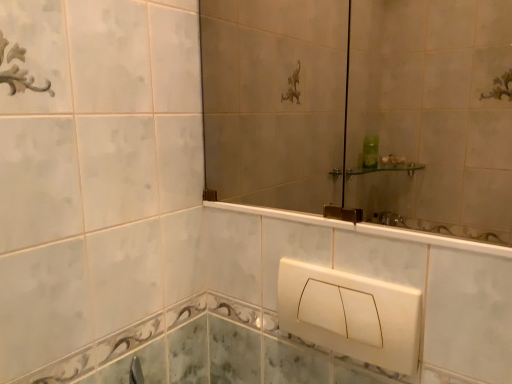
Question: From a real-world perspective, is matte glass mirror at upper center located beneath white plastic toilet cover at lower center?

Choices:
 (A) yes
 (B) no

Answer: (B)

Question: Is white plastic toilet cover at lower center located within matte glass mirror at upper center?

Choices:
 (A) yes
 (B) no

Answer: (B)

Question: Is matte glass mirror at upper center not close to white plastic toilet cover at lower center?

Choices:
 (A) no
 (B) yes

Answer: (A)

Question: Does matte glass mirror at upper center turn towards white plastic toilet cover at lower center?

Choices:
 (A) no
 (B) yes

Answer: (A)

Question: From the image's perspective, is matte glass mirror at upper center on white plastic toilet cover at lower center?

Choices:
 (A) no
 (B) yes

Answer: (B)

Question: Considering the relative positions of matte glass mirror at upper center and white plastic toilet cover at lower center in the image provided, is matte glass mirror at upper center to the left of white plastic toilet cover at lower center from the viewer's perspective?

Choices:
 (A) yes
 (B) no

Answer: (A)

Question: Can you confirm if white plastic toilet cover at lower center is wider than matte glass mirror at upper center?

Choices:
 (A) no
 (B) yes

Answer: (B)

Question: Is white plastic toilet cover at lower center oriented away from matte glass mirror at upper center?

Choices:
 (A) no
 (B) yes

Answer: (A)

Question: From a real-world perspective, does white plastic toilet cover at lower center sit lower than matte glass mirror at upper center?

Choices:
 (A) yes
 (B) no

Answer: (A)

Question: Considering the relative positions of white plastic toilet cover at lower center and matte glass mirror at upper center in the image provided, is white plastic toilet cover at lower center behind matte glass mirror at upper center?

Choices:
 (A) yes
 (B) no

Answer: (A)

Question: Does white plastic toilet cover at lower center have a lesser width compared to matte glass mirror at upper center?

Choices:
 (A) no
 (B) yes

Answer: (A)

Question: From the image's perspective, is white plastic toilet cover at lower center above matte glass mirror at upper center?

Choices:
 (A) yes
 (B) no

Answer: (B)

Question: Is point (305, 314) positioned closer to the camera than point (473, 142)?

Choices:
 (A) farther
 (B) closer

Answer: (B)